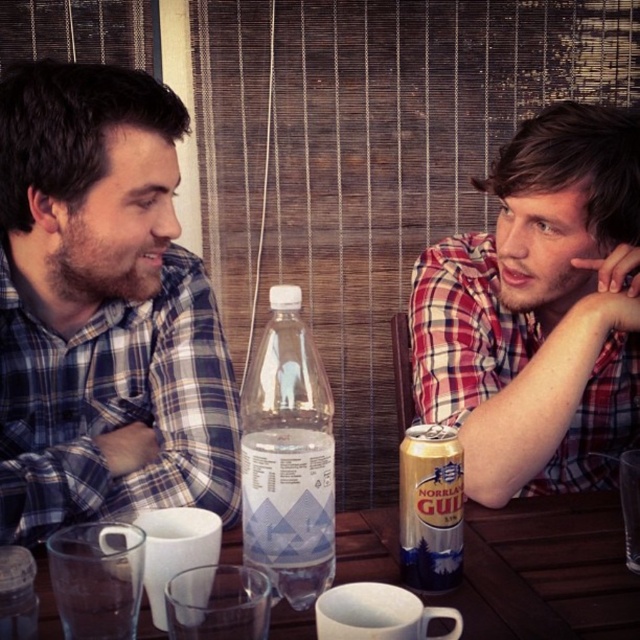
Consider the image. Does transparent plastic table at center come in front of gold aluminum can at center?

Yes.

Between transparent plastic table at center and gold aluminum can at center, which one appears on the left side from the viewer's perspective?

transparent plastic table at center

Locate an element on the screen. transparent plastic table at center is located at coordinates (547, 570).

I want to click on transparent plastic table at center, so click(x=547, y=570).

Looking at this image, does matte plaid shirt at left have a greater height compared to transparent plastic bottle at center?

Yes, matte plaid shirt at left is taller than transparent plastic bottle at center.

Which is above, matte plaid shirt at left or transparent plastic bottle at center?

matte plaid shirt at left is above.

Describe the element at coordinates (104, 308) in the screenshot. I see `matte plaid shirt at left` at that location.

This screenshot has height=640, width=640. I want to click on matte plaid shirt at left, so click(x=104, y=308).

Between point (570, 404) and point (452, 432), which one is positioned in front?

Point (452, 432) is in front.

The width and height of the screenshot is (640, 640). What do you see at coordinates (540, 310) in the screenshot?
I see `red plaid shirt at right` at bounding box center [540, 310].

The width and height of the screenshot is (640, 640). What do you see at coordinates (540, 310) in the screenshot?
I see `red plaid shirt at right` at bounding box center [540, 310].

Locate an element on the screen. red plaid shirt at right is located at coordinates (540, 310).